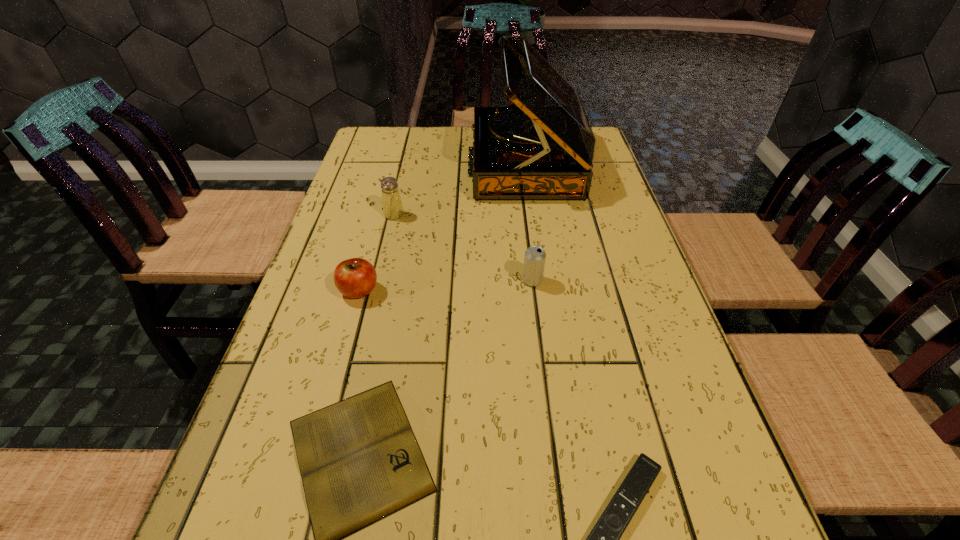
At what (x,y) coordinates should I click in order to perform the action: click on the tallest object. Please return your answer as a coordinate pair (x, y). This screenshot has height=540, width=960. Looking at the image, I should click on (543, 149).

Where is `the farthest object`? This screenshot has height=540, width=960. the farthest object is located at coordinates (543, 149).

I want to click on the second farthest object, so click(x=392, y=205).

Locate an element on the screen. saltshaker is located at coordinates (392, 205).

You are a GUI agent. You are given a task and a screenshot of the screen. Output one action in this format:
    pyautogui.click(x=<x>, y=<y>)
    Task: Click on the beer can
    Image resolution: width=960 pixels, height=540 pixels.
    Given the screenshot: What is the action you would take?
    pyautogui.click(x=534, y=261)

The image size is (960, 540). Identify the location of apple. (356, 277).

Identify the location of free region located 0.210m on the front-facing side of the record player. The width and height of the screenshot is (960, 540). (401, 164).

At what (x,y) coordinates should I click in order to perform the action: click on blank space located on the front-facing side of the record player. Please return your answer as a coordinate pair (x, y). Image resolution: width=960 pixels, height=540 pixels. Looking at the image, I should click on (418, 164).

Identify the location of vacant space located on the front-facing side of the record player. The width and height of the screenshot is (960, 540). (363, 164).

At what (x,y) coordinates should I click in order to perform the action: click on vacant space located 0.170m on the front of the saltshaker. Please return your answer as a coordinate pair (x, y). Looking at the image, I should click on (382, 265).